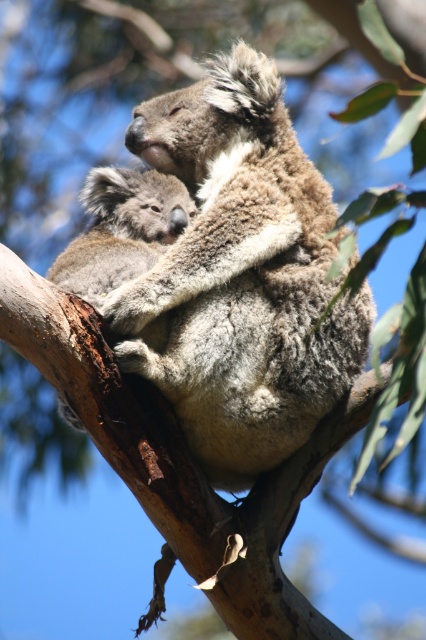
Between fuzzy brown koala at center and fuzzy gray koala at center, which one is positioned lower?

fuzzy gray koala at center is lower down.

Who is shorter, fuzzy brown koala at center or fuzzy gray koala at center?

fuzzy gray koala at center is shorter.

The width and height of the screenshot is (426, 640). What do you see at coordinates (241, 275) in the screenshot? I see `fuzzy brown koala at center` at bounding box center [241, 275].

You are a GUI agent. You are given a task and a screenshot of the screen. Output one action in this format:
    pyautogui.click(x=<x>, y=<y>)
    Task: Click on the fuzzy brown koala at center
    
    Given the screenshot: What is the action you would take?
    pyautogui.click(x=241, y=275)